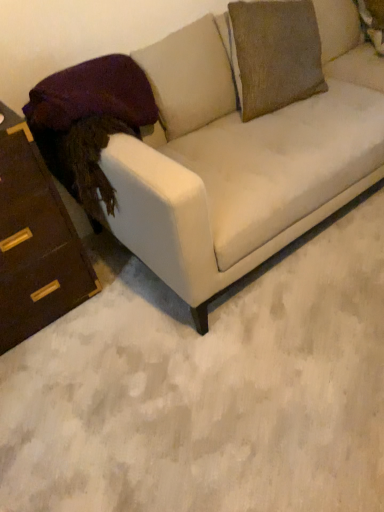
Question: Is matte white couch at center inside the boundaries of velvet purple pillow at left, or outside?

Choices:
 (A) inside
 (B) outside

Answer: (B)

Question: In terms of size, does matte white couch at center appear bigger or smaller than velvet purple pillow at left?

Choices:
 (A) big
 (B) small

Answer: (A)

Question: Which of these objects is positioned closest to the velvet purple pillow at left?

Choices:
 (A) brown wood chest of drawers at left
 (B) matte white couch at center

Answer: (A)

Question: Which object is the closest to the velvet purple pillow at left?

Choices:
 (A) matte white couch at center
 (B) brown wood chest of drawers at left

Answer: (B)